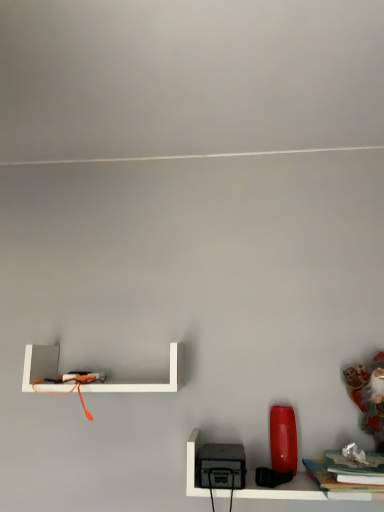
Question: Considering the positions of white matte shelf at upper left, the 2th shelf ordered from the bottom, and velvet santa at right in the image, is white matte shelf at upper left, the 2th shelf ordered from the bottom, wider or thinner than velvet santa at right?

Choices:
 (A) thin
 (B) wide

Answer: (B)

Question: In the image, is white matte shelf at upper left, marked as the 1th shelf in a left-to-right arrangement, positioned in front of or behind velvet santa at right?

Choices:
 (A) behind
 (B) front

Answer: (A)

Question: Based on their relative distances, which object is nearer to the matte black toaster at lower right, the first shelf from the right?

Choices:
 (A) white matte shelf at upper left, which is the first shelf from top to bottom
 (B) velvet santa at right
 (C) hardcover book at lower right

Answer: (C)

Question: Estimate the real-world distances between objects in this image. Which object is closer to the white matte shelf at upper left, marked as the 1th shelf in a left-to-right arrangement?

Choices:
 (A) matte black toaster at lower right, the 2th shelf positioned from the top
 (B) velvet santa at right
 (C) hardcover book at lower right

Answer: (A)